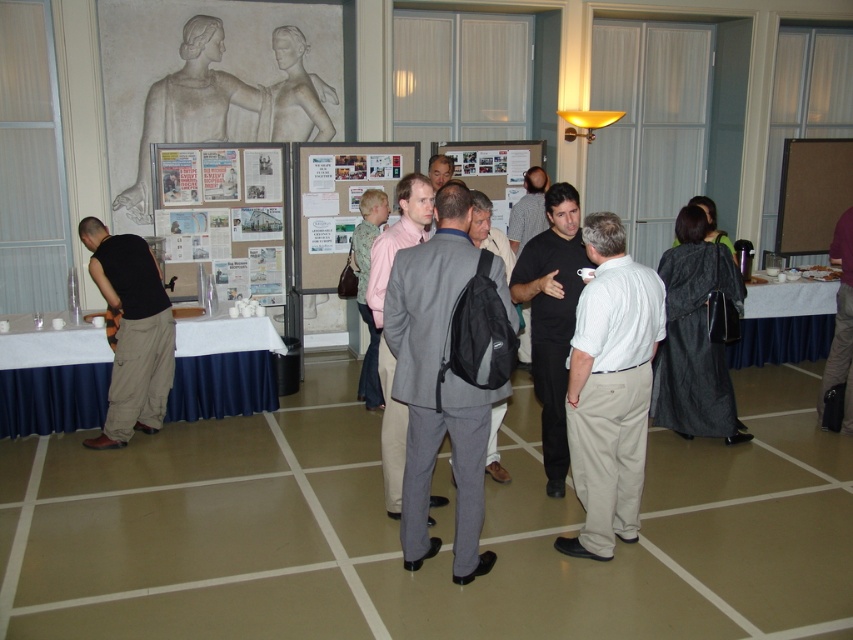
You are standing in the middle of the room and see the point marked at coordinates (227, 214). What object is located at that point?

The point marked at coordinates (227, 214) marks a white paper poster at center.

You are attending an indoor event and see a gray fabric suit at center and a white cotton shirt at center. Which clothing item is taller?

The gray fabric suit at center is much taller than the white cotton shirt at center.